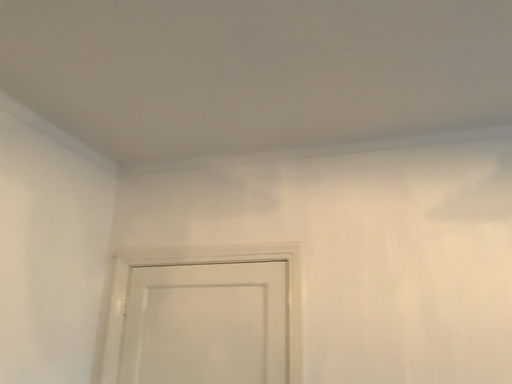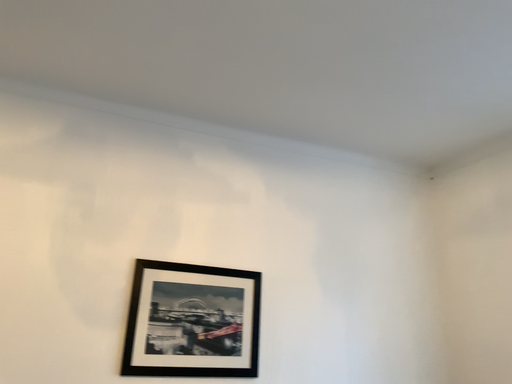
Question: How did the camera likely rotate when shooting the video?

Choices:
 (A) rotated upward
 (B) rotated downward

Answer: (B)